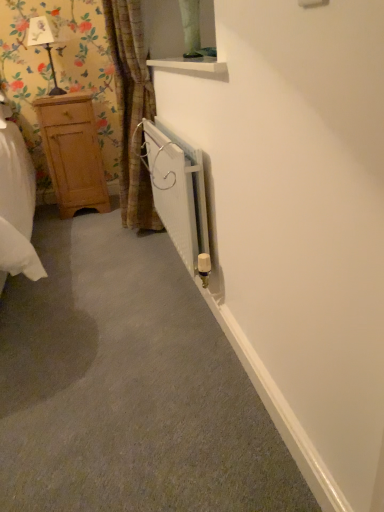
Question: Which is correct: white metallic radiator at center is inside matte black lamp at upper left, or outside of it?

Choices:
 (A) outside
 (B) inside

Answer: (A)

Question: Is white metallic radiator at center to the left or to the right of matte black lamp at upper left in the image?

Choices:
 (A) left
 (B) right

Answer: (B)

Question: Based on their relative distances, which object is nearer to the matte black lamp at upper left?

Choices:
 (A) brown textured curtain at left
 (B) light brown wooden dresser at left
 (C) white metallic radiator at center

Answer: (B)

Question: Which object is the closest to the matte black lamp at upper left?

Choices:
 (A) white metallic radiator at center
 (B) light brown wooden dresser at left
 (C) brown textured curtain at left

Answer: (B)